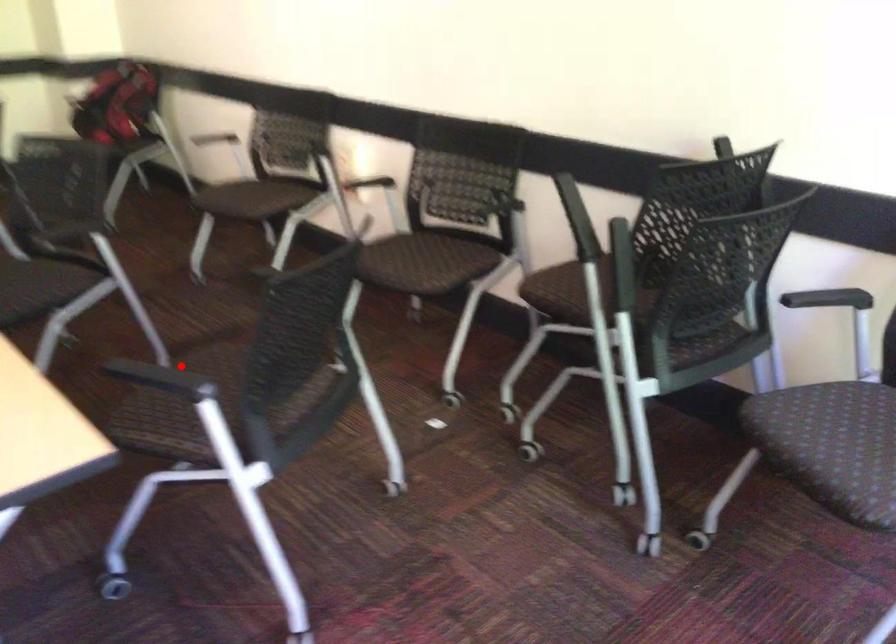
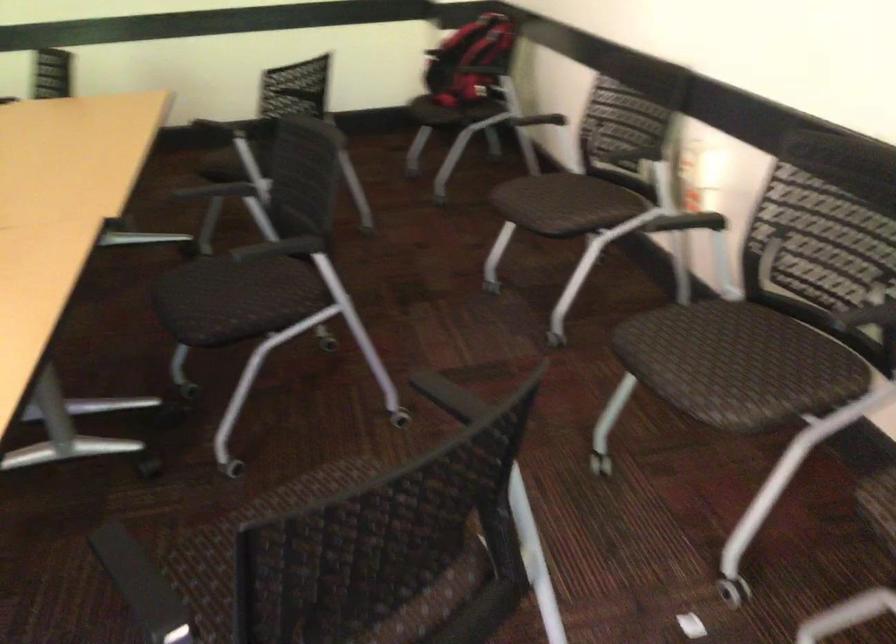
Question: I am providing you with two images of the same scene from different viewpoints. A red point is marked on the first image. At the location where the point appears in image 1, is it still visible in image 2?

Choices:
 (A) Yes
 (B) No

Answer: (A)